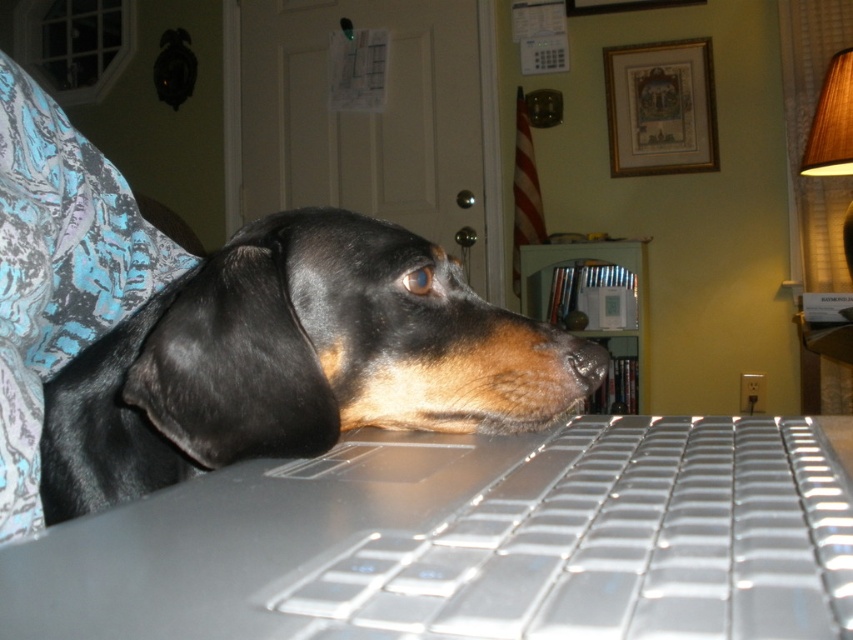
Question: Can you confirm if black shiny fur at center is positioned above silver/transparent plastic keyboard at center?

Choices:
 (A) no
 (B) yes

Answer: (B)

Question: Which point is farther to the camera?

Choices:
 (A) (573, 444)
 (B) (606, 358)
 (C) (482, 348)

Answer: (B)

Question: Is silver/transparent plastic keyboard at center above brown matte nose at center?

Choices:
 (A) yes
 (B) no

Answer: (B)

Question: Does silver/transparent plastic keyboard at center have a smaller size compared to brown matte nose at center?

Choices:
 (A) yes
 (B) no

Answer: (B)

Question: Which object is closer to the camera taking this photo?

Choices:
 (A) black shiny fur at center
 (B) brown matte nose at center

Answer: (A)

Question: Which of the following is the farthest from the observer?

Choices:
 (A) silver/transparent plastic keyboard at center
 (B) black shiny fur at center
 (C) brown matte nose at center

Answer: (C)